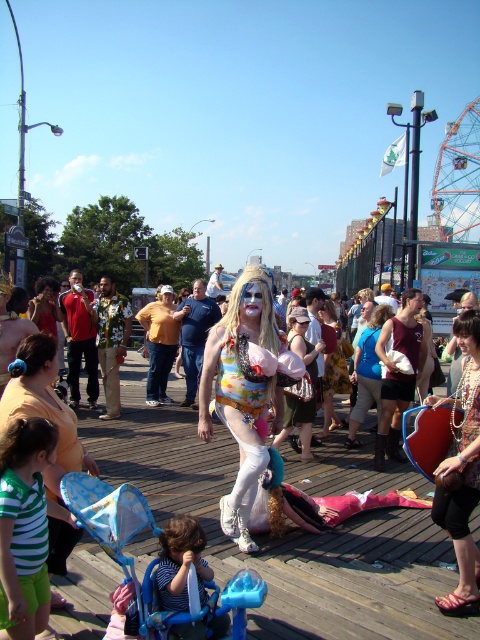
You are a photographer trying to capture both the red fabric shirt at left and the blue denim jeans at center in a single frame. Which object should you focus on first to ensure both are in the frame?

You should focus on the blue denim jeans at center first because it occupies more space than the red fabric shirt at left, ensuring it fits properly before adjusting for the smaller object.

Looking at this image, you are at a festival on a boardwalk and see two items in the center area. The blue denim jeans at center and the matte yellow shirt at center. Which one is positioned to the left?

The blue denim jeans at center are positioned to the left of the matte yellow shirt at center.

You are standing at the camera position and want to toss a frisbee to a friend who is near the red fabric shirt at left. If the frisbee can travel 50 meters, will it reach them?

The distance between you and the red fabric shirt at left is 55.47 meters. Since the frisbee can only travel 50 meters, it will not reach your friend.